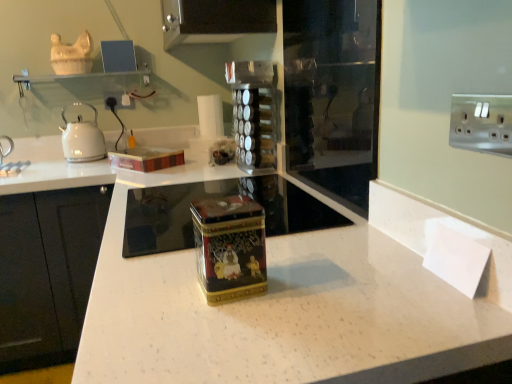
Find the location of a particular element. The width and height of the screenshot is (512, 384). empty space that is ontop of white speckled granite at center (from a real-world perspective) is located at coordinates (279, 240).